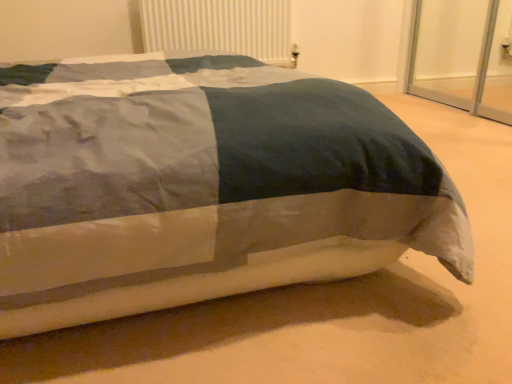
What do you see at coordinates (202, 186) in the screenshot? I see `textured cotton bed at center` at bounding box center [202, 186].

At what (x,y) coordinates should I click in order to perform the action: click on textured cotton bed at center. Please return your answer as a coordinate pair (x, y). This screenshot has height=384, width=512. Looking at the image, I should click on (202, 186).

You are a GUI agent. You are given a task and a screenshot of the screen. Output one action in this format:
    pyautogui.click(x=<x>, y=<y>)
    Task: Click on the white plastic radiator at upper center
    The image size is (512, 384).
    Given the screenshot: What is the action you would take?
    pyautogui.click(x=219, y=27)

What do you see at coordinates (219, 27) in the screenshot? I see `white plastic radiator at upper center` at bounding box center [219, 27].

Locate an element on the screen. textured cotton bed at center is located at coordinates (202, 186).

Is white plastic radiator at upper center at the left side of textured cotton bed at center?

Yes, white plastic radiator at upper center is to the left of textured cotton bed at center.

Which object is further away from the camera, white plastic radiator at upper center or textured cotton bed at center?

white plastic radiator at upper center.

Considering the points (169, 3) and (89, 264), which point is behind, point (169, 3) or point (89, 264)?

The point (169, 3) is farther.

From the image's perspective, which is above, white plastic radiator at upper center or textured cotton bed at center?

From the image's view, white plastic radiator at upper center is above.

From a real-world perspective, is white plastic radiator at upper center located higher than textured cotton bed at center?

Yes, from a real-world perspective, white plastic radiator at upper center is on top of textured cotton bed at center.

Considering the relative sizes of white plastic radiator at upper center and textured cotton bed at center in the image provided, is white plastic radiator at upper center thinner than textured cotton bed at center?

Yes.

Can you confirm if white plastic radiator at upper center is shorter than textured cotton bed at center?

No, white plastic radiator at upper center is not shorter than textured cotton bed at center.

Looking at this image, can you confirm if white plastic radiator at upper center is smaller than textured cotton bed at center?

Indeed, white plastic radiator at upper center has a smaller size compared to textured cotton bed at center.

From the picture: Which is correct: white plastic radiator at upper center is inside textured cotton bed at center, or outside of it?

white plastic radiator at upper center is not enclosed by textured cotton bed at center.

Is the surface of white plastic radiator at upper center in direct contact with textured cotton bed at center?

white plastic radiator at upper center and textured cotton bed at center are clearly separated.

Could you tell me if white plastic radiator at upper center is turned towards textured cotton bed at center?

Yes, white plastic radiator at upper center faces towards textured cotton bed at center.

Where is `bed located in front of the white plastic radiator at upper center`? The image size is (512, 384). bed located in front of the white plastic radiator at upper center is located at coordinates (202, 186).

Considering the relative positions of textured cotton bed at center and white plastic radiator at upper center in the image provided, is textured cotton bed at center to the left of white plastic radiator at upper center from the viewer's perspective?

No.

Between textured cotton bed at center and white plastic radiator at upper center, which one is positioned in front?

textured cotton bed at center.

Which point is more distant from viewer, (x=247, y=192) or (x=237, y=51)?

The point (x=237, y=51) is more distant.

From the image's perspective, which is below, textured cotton bed at center or white plastic radiator at upper center?

textured cotton bed at center, from the image's perspective.

From a real-world perspective, is textured cotton bed at center positioned above or below white plastic radiator at upper center?

textured cotton bed at center is below white plastic radiator at upper center.

Considering the relative sizes of textured cotton bed at center and white plastic radiator at upper center in the image provided, is textured cotton bed at center wider than white plastic radiator at upper center?

Correct, the width of textured cotton bed at center exceeds that of white plastic radiator at upper center.

Is textured cotton bed at center taller than white plastic radiator at upper center?

No.

Who is smaller, textured cotton bed at center or white plastic radiator at upper center?

With smaller size is white plastic radiator at upper center.

Consider the image. Could white plastic radiator at upper center be considered to be inside textured cotton bed at center?

Definitely not — white plastic radiator at upper center is not inside textured cotton bed at center.

Are textured cotton bed at center and white plastic radiator at upper center located far from each other?

That's right, there is a large distance between textured cotton bed at center and white plastic radiator at upper center.

Is textured cotton bed at center positioned with its back to white plastic radiator at upper center?

No, textured cotton bed at center is not facing away from white plastic radiator at upper center.

What's the angular difference between textured cotton bed at center and white plastic radiator at upper center's facing directions?

They differ by 180 degrees in their facing directions.

Find the location of a particular element. The image size is (512, 384). radiator lying on the left of textured cotton bed at center is located at coordinates (219, 27).

You are a GUI agent. You are given a task and a screenshot of the screen. Output one action in this format:
    pyautogui.click(x=<x>, y=<y>)
    Task: Click on the bed lying on the right of white plastic radiator at upper center
    
    Given the screenshot: What is the action you would take?
    pyautogui.click(x=202, y=186)

At what (x,y) coordinates should I click in order to perform the action: click on bed below the white plastic radiator at upper center (from the image's perspective). Please return your answer as a coordinate pair (x, y). Looking at the image, I should click on (202, 186).